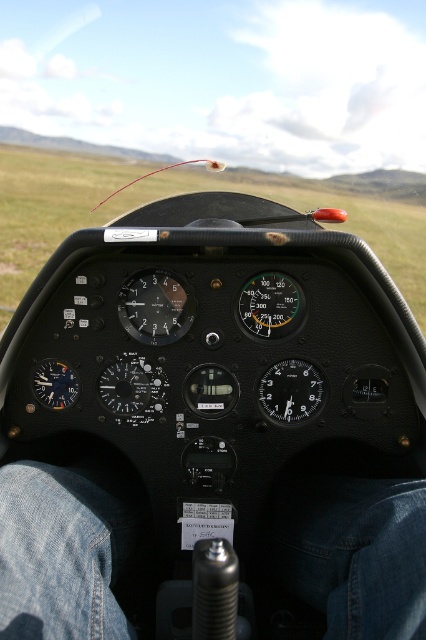
Which of these two, jeans at lower center or green grass at center, stands taller?

With more height is green grass at center.

Who is more forward, [8,474] or [296,193]?

Point [8,474]

Is point (109, 579) behind point (25, 234)?

No, it is not.

Image resolution: width=426 pixels, height=640 pixels. What are the coordinates of `jeans at lower center` in the screenshot? It's located at (354, 552).